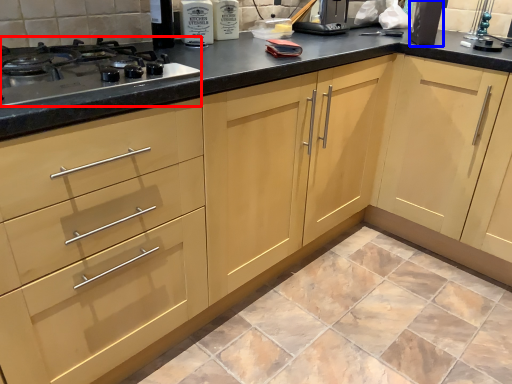
Question: Which point is further to the camera, gas stove (highlighted by a red box) or appliance (highlighted by a blue box)?

Choices:
 (A) gas stove
 (B) appliance

Answer: (B)